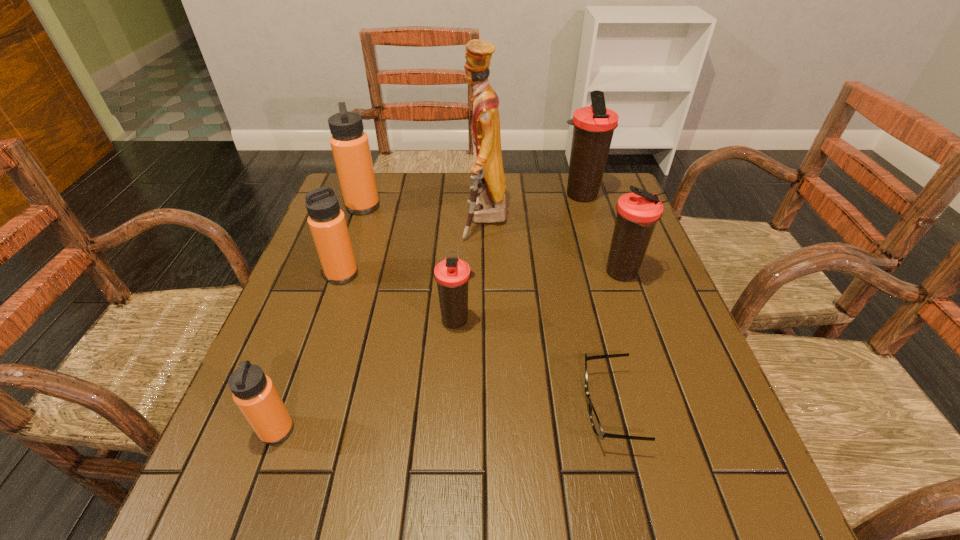
Find the location of a particular element. the tallest object is located at coordinates (487, 204).

I want to click on red nutcracker, so click(487, 204).

I want to click on the biggest brown thermos bottle, so click(594, 125).

Where is `the farthest orange thermos bottle`? the farthest orange thermos bottle is located at coordinates (350, 146).

Identify the location of the second biggest brown thermos bottle. Image resolution: width=960 pixels, height=540 pixels. (637, 213).

The width and height of the screenshot is (960, 540). In order to click on the second farthest orange thermos bottle in this screenshot , I will do `click(327, 223)`.

Locate an element on the screen. the nearest brown thermos bottle is located at coordinates (452, 274).

You are a GUI agent. You are given a task and a screenshot of the screen. Output one action in this format:
    pyautogui.click(x=<x>, y=<y>)
    Task: Click on the leftmost brown thermos bottle
    Image resolution: width=960 pixels, height=540 pixels.
    Given the screenshot: What is the action you would take?
    pyautogui.click(x=452, y=274)

Where is `the smallest orange thermos bottle`? The width and height of the screenshot is (960, 540). the smallest orange thermos bottle is located at coordinates (254, 393).

I want to click on the nearest orange thermos bottle, so click(254, 393).